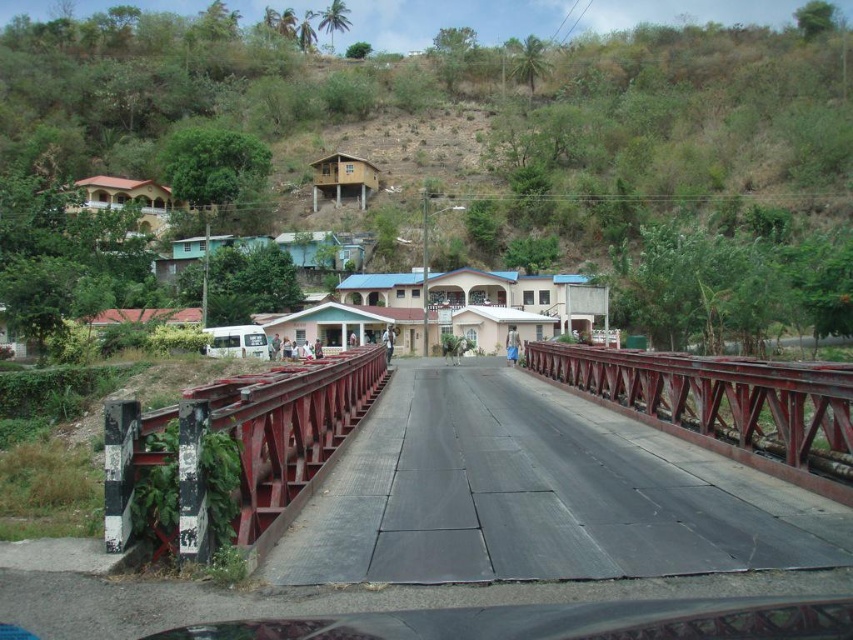
Question: Can you confirm if metallic bridge at center is positioned to the left of rusty metal bridge at left?

Choices:
 (A) yes
 (B) no

Answer: (B)

Question: Is metallic bridge at center below rusty metal bridge at left?

Choices:
 (A) yes
 (B) no

Answer: (B)

Question: Is metallic bridge at center to the left of rusty metal bridge at left from the viewer's perspective?

Choices:
 (A) yes
 (B) no

Answer: (B)

Question: Among these points, which one is farthest from the camera?

Choices:
 (A) (283, 433)
 (B) (306, 445)

Answer: (B)

Question: Which point appears farthest from the camera in this image?

Choices:
 (A) (x=289, y=420)
 (B) (x=675, y=532)

Answer: (A)

Question: Which object appears closest to the camera in this image?

Choices:
 (A) rusty metal bridge at left
 (B) metallic bridge at center

Answer: (B)